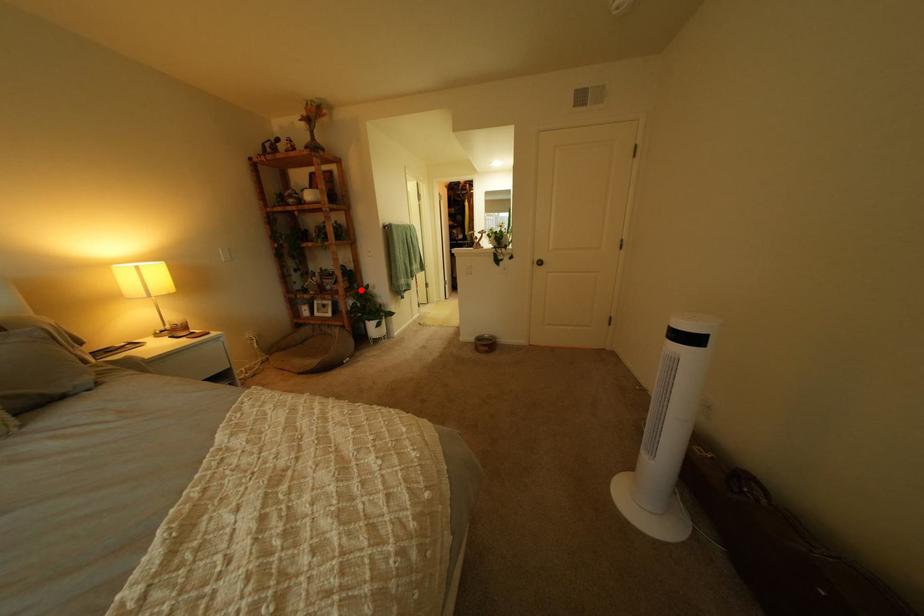
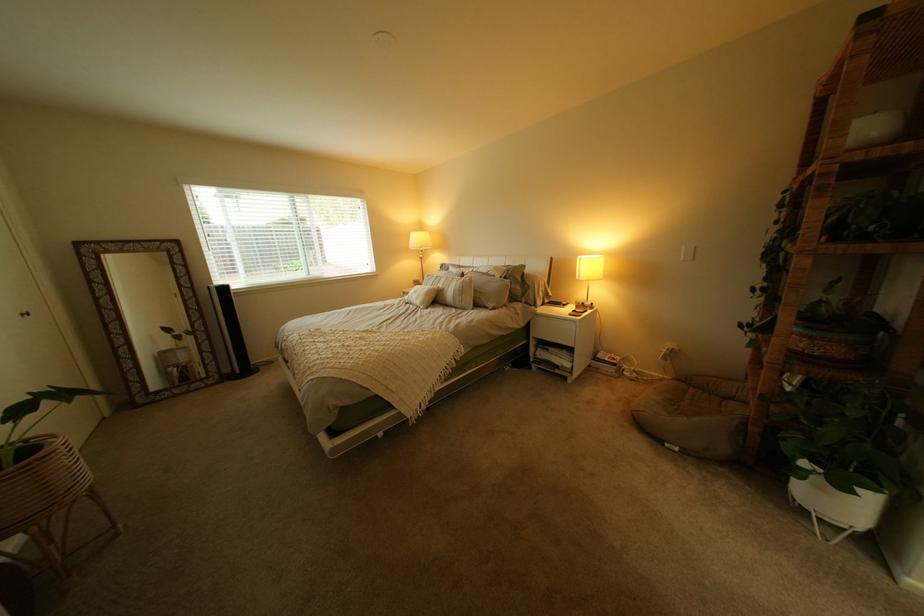
Question: I am providing you with two images of the same scene from different viewpoints. A red point is shown in image1. For the corresponding object point in image2, is it positioned nearer or farther from the camera?

Choices:
 (A) Nearer
 (B) Farther

Answer: (B)